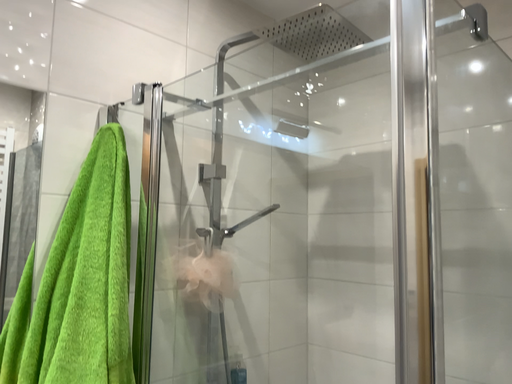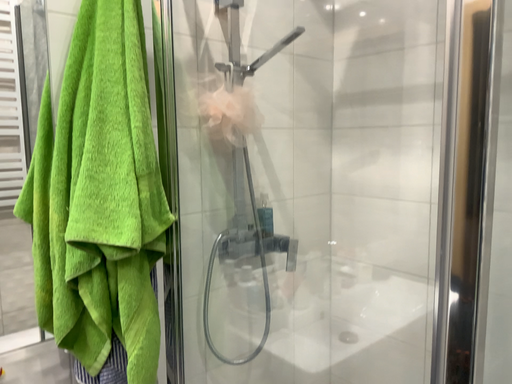
Question: Which way did the camera rotate in the video?

Choices:
 (A) rotated downward
 (B) rotated upward

Answer: (A)